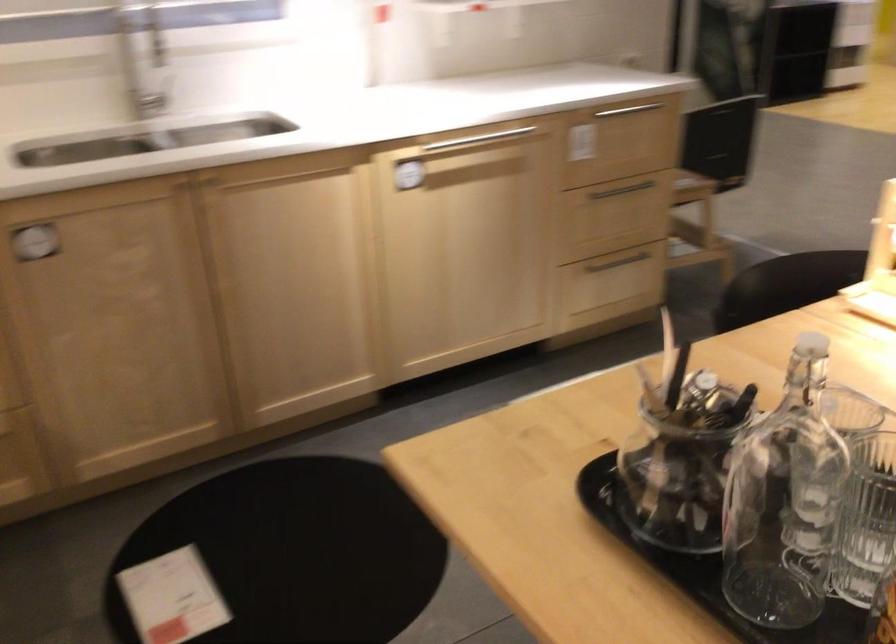
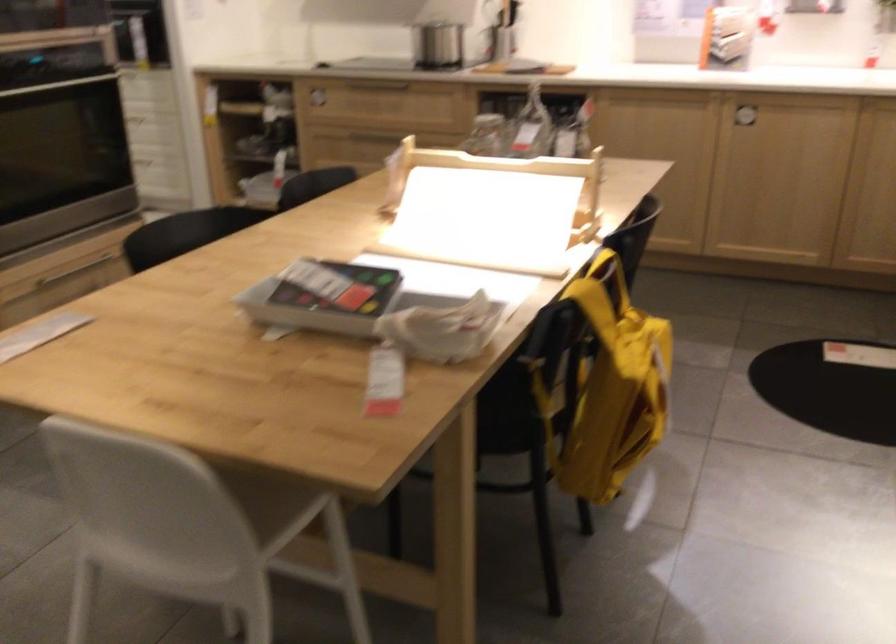
Question: I am providing you with two images of the same scene from different viewpoints. After the viewpoint changes to image2, which objects are now occluded?

Choices:
 (A) silver stovetop knob
 (B) bottle stopper
 (C) oven door handle
 (D) wooden paper holder

Answer: (B)